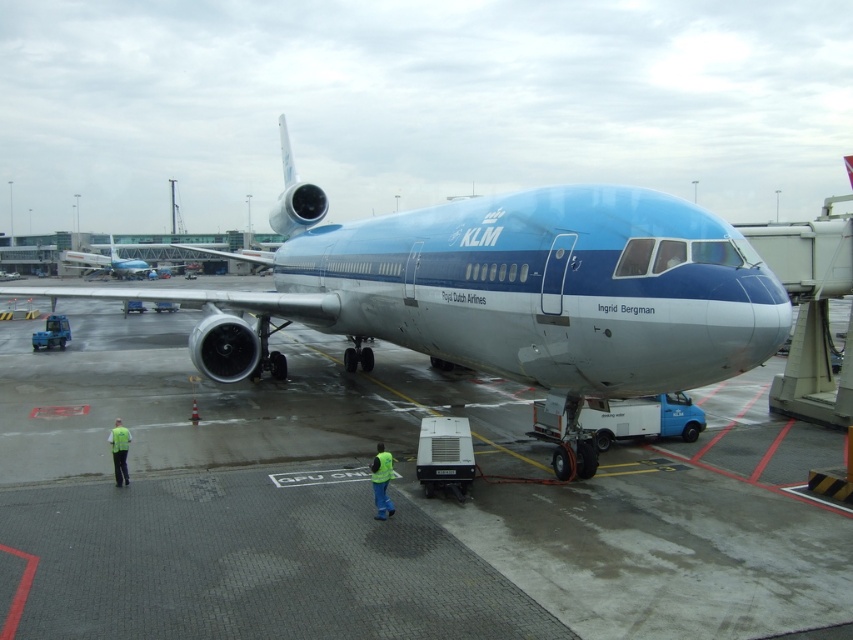
You are standing at the point with coordinates point (x=761, y=356) and want to walk to the point with coordinates point (x=328, y=602). According to the scene description, which direction should you face to walk towards your destination?

You should face forward because point (x=328, y=602) is in front of point (x=761, y=356).

You are a ground crew member who needs to access the yellow reflective vest at lower left. The metallic blue airplane at center is blocking your path. Can you walk around the airplane to reach the vest without going under it?

The metallic blue airplane at center is positioned over yellow reflective vest at lower left, meaning the vest is directly beneath the airplane. Therefore, you cannot walk around the airplane to reach the vest without going under it since the vest is already under the airplane.